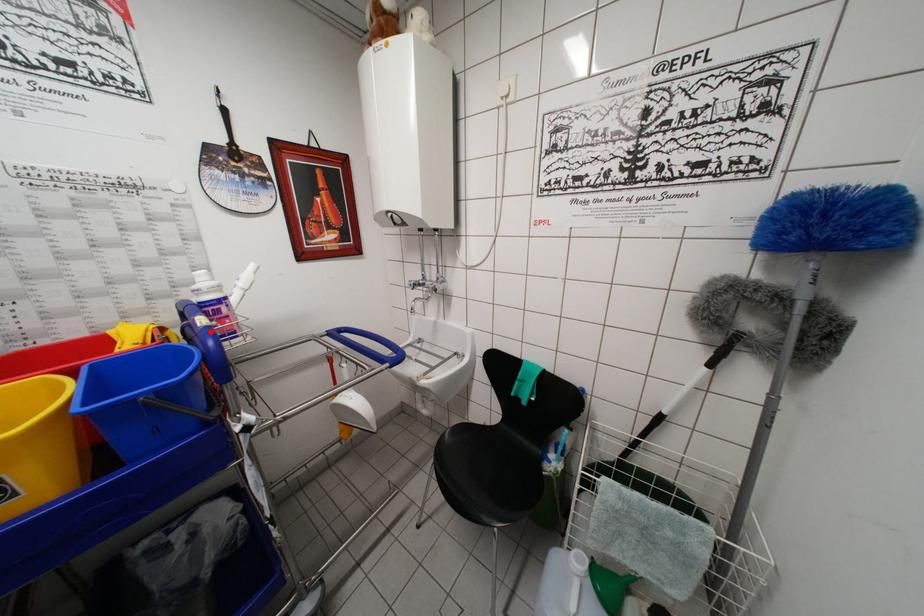
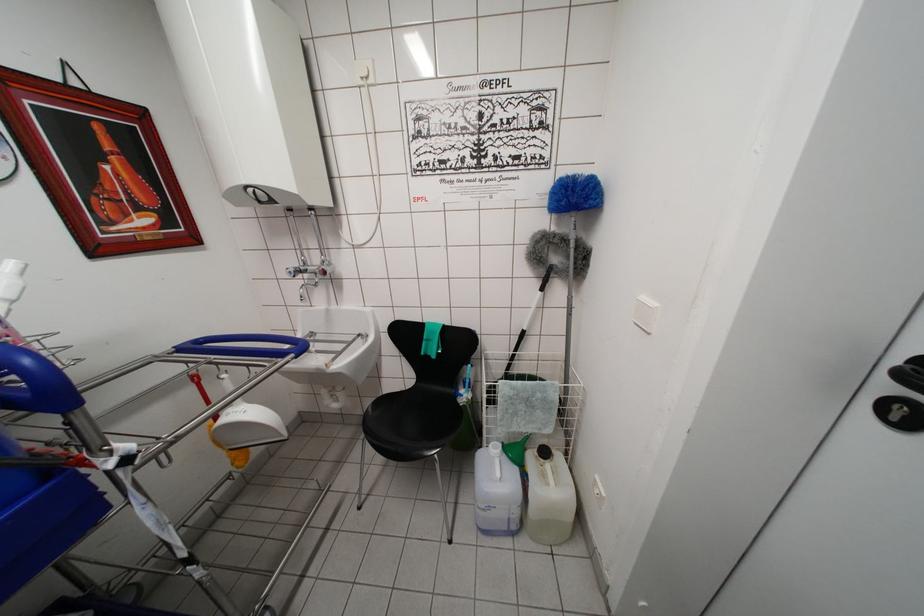
Find the pixel in the second image that matches the highlighted location in the first image.

(5, 349)